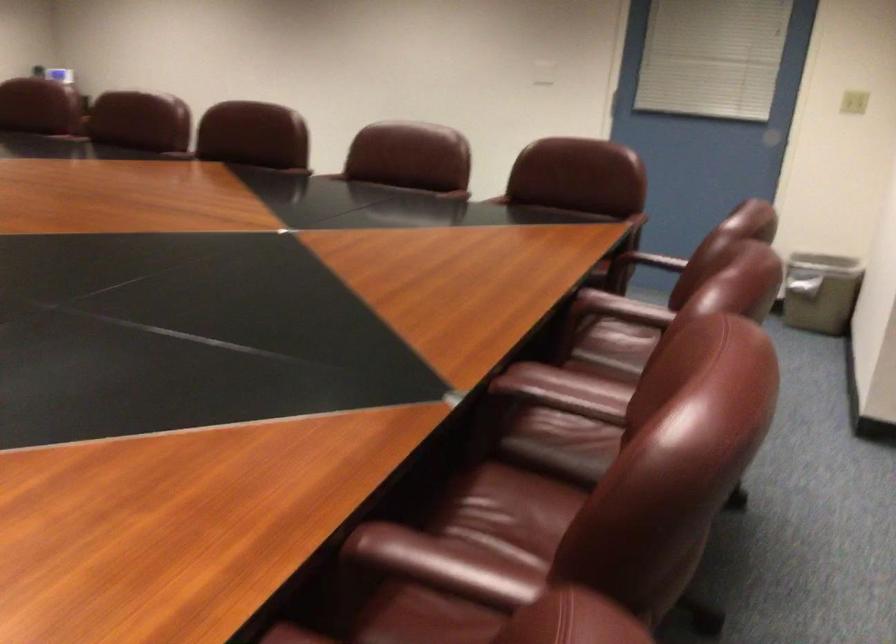
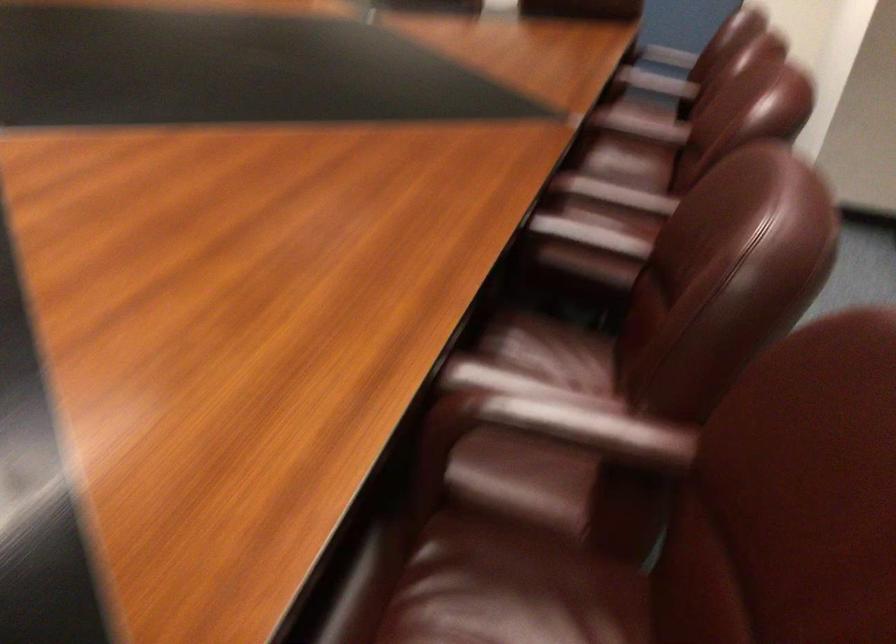
Find the pixel in the second image that matches the point at 433,573 in the first image.

(613, 194)